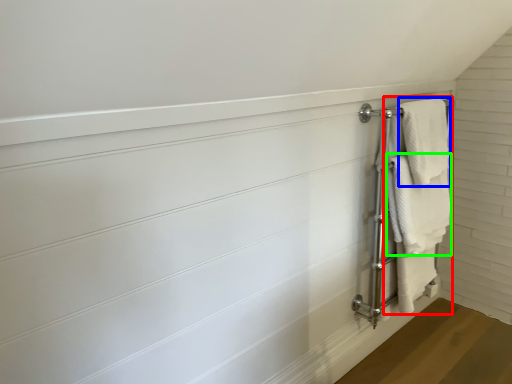
Question: Estimate the real-world distances between objects in this image. Which object is farther from bath towel (highlighted by a red box), bath towel (highlighted by a blue box) or towel (highlighted by a green box)?

Choices:
 (A) bath towel
 (B) towel

Answer: (A)